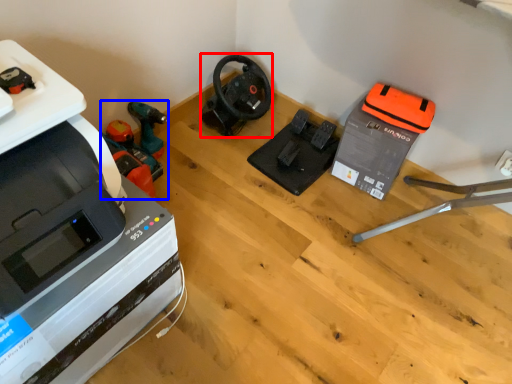
Question: Which object is closer to the camera taking this photo, vacuum (highlighted by a red box) or vacuum (highlighted by a blue box)?

Choices:
 (A) vacuum
 (B) vacuum

Answer: (B)